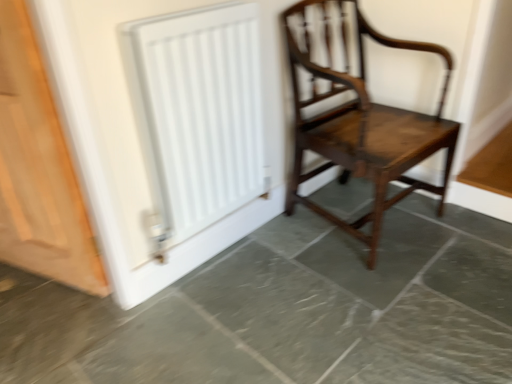
You are a GUI agent. You are given a task and a screenshot of the screen. Output one action in this format:
    pyautogui.click(x=<x>, y=<y>)
    Task: Click on the vacant space underneath white matte radiator at upper left (from a real-world perspective)
    The image size is (512, 384).
    Given the screenshot: What is the action you would take?
    tap(219, 252)